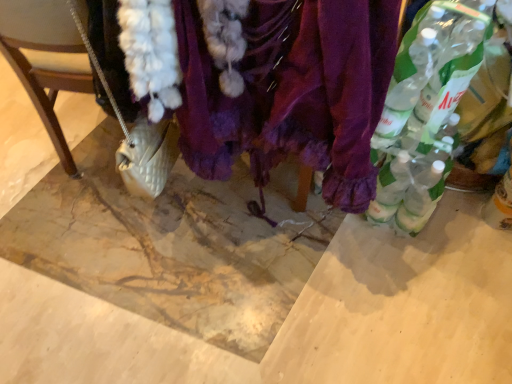
Question: Visually, is clear plastic bottle at right, the 2th bottle positioned from the left, positioned to the left or to the right of purple velvet scarf at center?

Choices:
 (A) right
 (B) left

Answer: (A)

Question: From the image's perspective, is clear plastic bottle at right, the 2th bottle positioned from the left, positioned above or below purple velvet scarf at center?

Choices:
 (A) above
 (B) below

Answer: (A)

Question: Which of these objects is positioned farthest from the clear plastic bottles at right, acting as the 1th bottle starting from the left?

Choices:
 (A) clear plastic bottle at right, the 2th bottle positioned from the left
 (B) purple velvet scarf at center
 (C) white quilted purse at lower left
 (D) translucent plastic bottle at lower right, the first bottle from the right

Answer: (C)

Question: Estimate the real-world distances between objects in this image. Which object is farther from the white quilted purse at lower left?

Choices:
 (A) translucent plastic bottle at lower right, the first bottle from the right
 (B) purple velvet scarf at center
 (C) clear plastic bottle at right, the 2th bottle positioned from the left
 (D) clear plastic bottles at right, which appears as the 3th bottle when viewed from the right

Answer: (A)